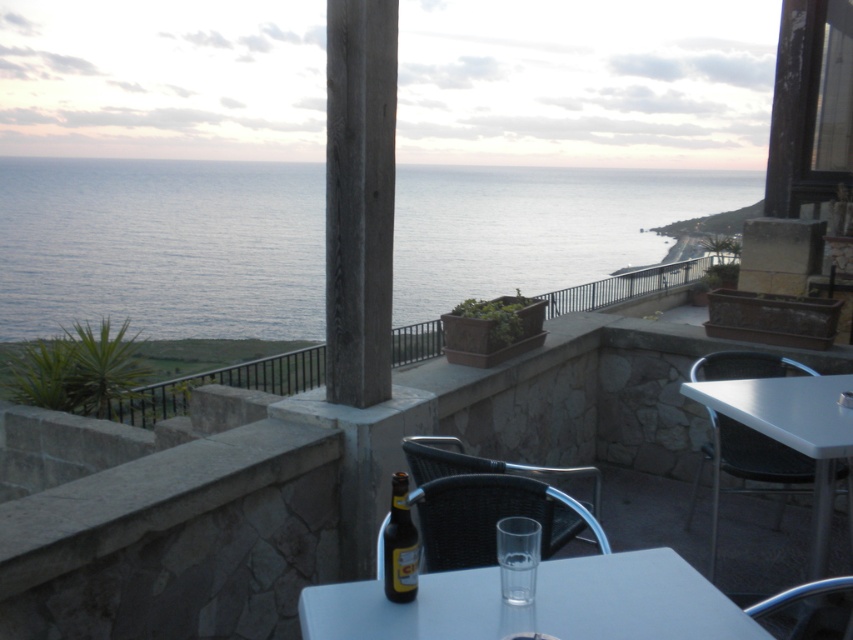
You are a delivery person carrying a package that is 16 inches long. You need to place it between the black wicker chair at center and the brown glass bottle at lower center. Is there enough space between them to fit the package?

The black wicker chair at center is 14.66 inches away from the brown glass bottle at lower center. Since the package is 16 inches long, it cannot fit between them as the distance is shorter than the package length.